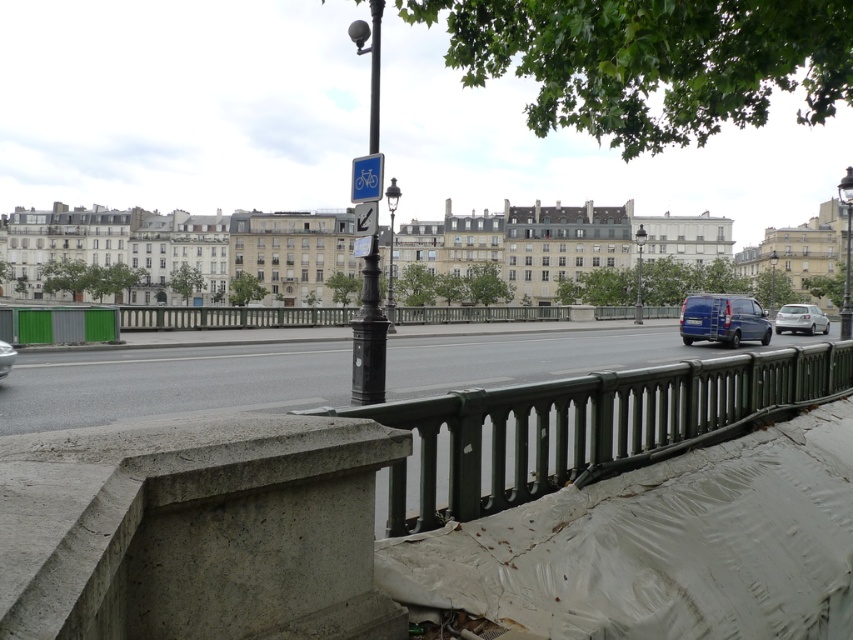
Question: Can you confirm if blue plastic sign at upper center is wider than metallic silver car at lower left?

Choices:
 (A) no
 (B) yes

Answer: (B)

Question: Can you confirm if black metal pole at center is thinner than metallic silver car at lower left?

Choices:
 (A) yes
 (B) no

Answer: (B)

Question: Is green metal railing at center above blue plastic sign at upper center?

Choices:
 (A) yes
 (B) no

Answer: (B)

Question: Which point is farther to the camera?

Choices:
 (A) (706, 310)
 (B) (822, 333)

Answer: (B)

Question: Which point is farther from the camera taking this photo?

Choices:
 (A) (13, 362)
 (B) (581, 461)
 (C) (376, 198)

Answer: (A)

Question: Which point appears farthest from the camera in this image?

Choices:
 (A) (805, 323)
 (B) (381, 172)
 (C) (369, 337)

Answer: (A)